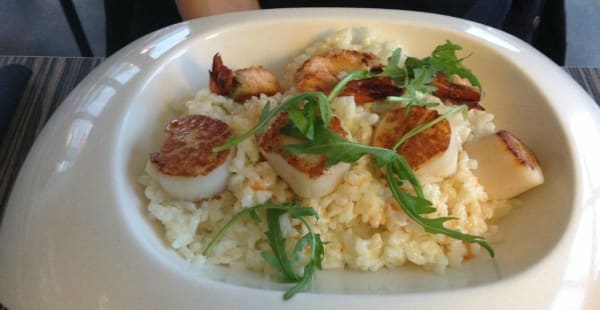
The height and width of the screenshot is (310, 600). Find the location of `reflected light on right side of plate rim`. reflected light on right side of plate rim is located at coordinates (574, 270), (594, 172), (565, 305), (487, 33).